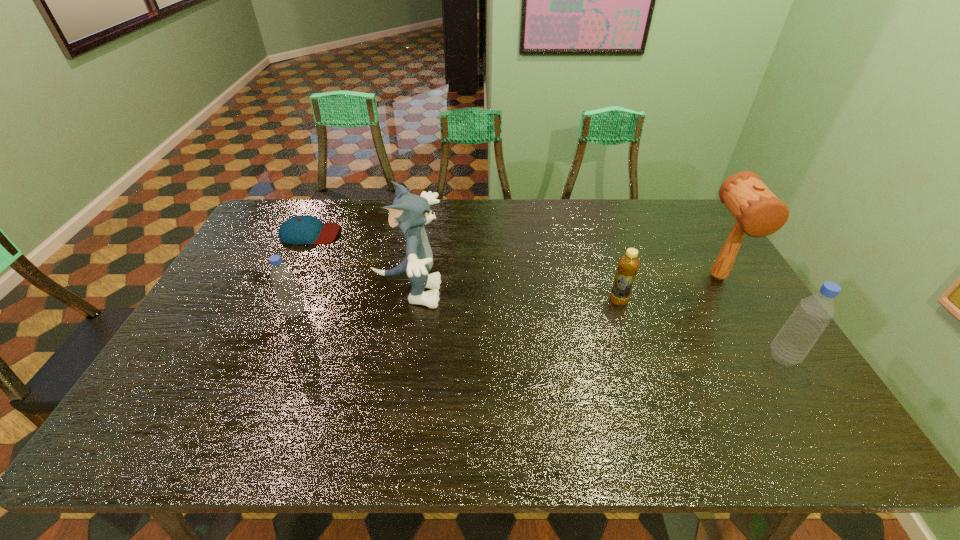
Locate an element on the screen. The width and height of the screenshot is (960, 540). free space that satisfies the following two spatial constraints: 1. on the front-facing side of the third tallest object; 2. on the left side of the fourth object from right to left is located at coordinates (397, 357).

Identify the location of vacant space that satisfies the following two spatial constraints: 1. with the bill of the third object from right to left facing forward; 2. on the right side of the shortest object. This screenshot has width=960, height=540. (278, 300).

Locate an element on the screen. vacant region that satisfies the following two spatial constraints: 1. with the bill of the shortest object facing forward; 2. on the right side of the tallest bottle is located at coordinates (251, 357).

The height and width of the screenshot is (540, 960). Identify the location of vacant space that satisfies the following two spatial constraints: 1. with the bill of the baseball cap facing forward; 2. on the left side of the leftmost bottle. (273, 312).

Locate an element on the screen. This screenshot has height=540, width=960. vacant region that satisfies the following two spatial constraints: 1. on the back side of the third object from right to left; 2. on the left side of the leftmost bottle is located at coordinates (300, 300).